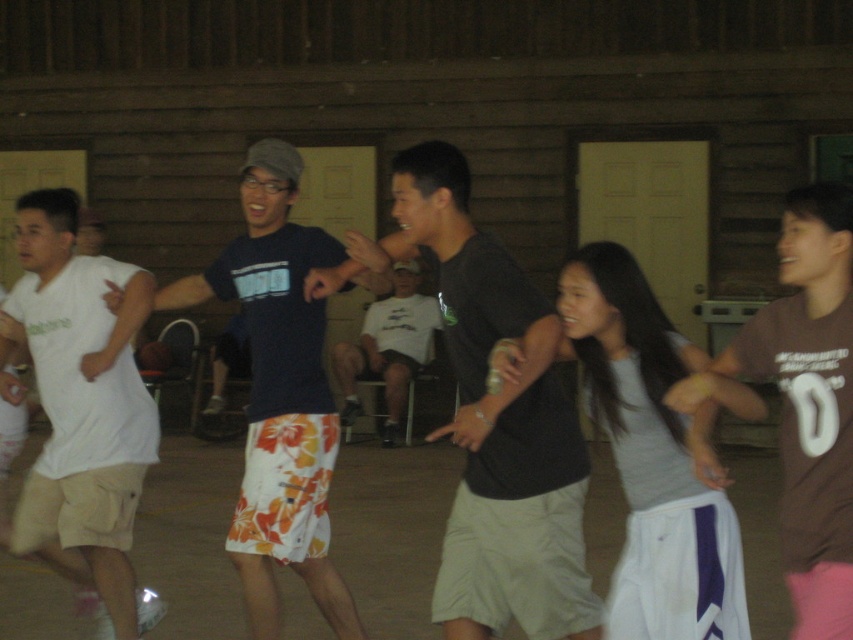
Can you confirm if floral shorts at center is positioned above white cotton t-shirt at left?

Yes, floral shorts at center is above white cotton t-shirt at left.

Does floral shorts at center have a greater height compared to white cotton t-shirt at left?

Yes.

Is point (322, 477) positioned before point (78, 412)?

Yes, it is.

Identify the location of floral shorts at center. This screenshot has height=640, width=853. (279, 394).

What do you see at coordinates (82, 397) in the screenshot? I see `white cotton t-shirt at left` at bounding box center [82, 397].

How much distance is there between white cotton t-shirt at left and brown cotton t-shirt at right?

white cotton t-shirt at left and brown cotton t-shirt at right are 10.97 feet apart.

Is point (7, 301) farther from viewer compared to point (786, 248)?

Yes, it is.

At what (x,y) coordinates should I click in order to perform the action: click on white cotton t-shirt at left. Please return your answer as a coordinate pair (x, y). Looking at the image, I should click on (82, 397).

Between dark gray t-shirt at center and floral shorts at center, which one is positioned lower?

Positioned lower is floral shorts at center.

Who is more distant from viewer, (544,336) or (253,372)?

Positioned behind is point (253,372).

This screenshot has width=853, height=640. In order to click on dark gray t-shirt at center in this screenshot , I will do `click(496, 420)`.